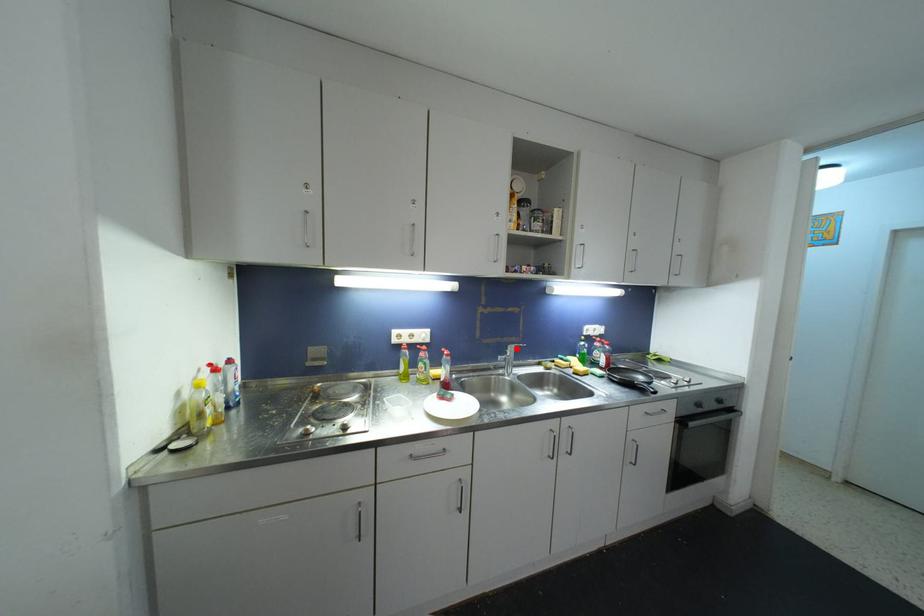
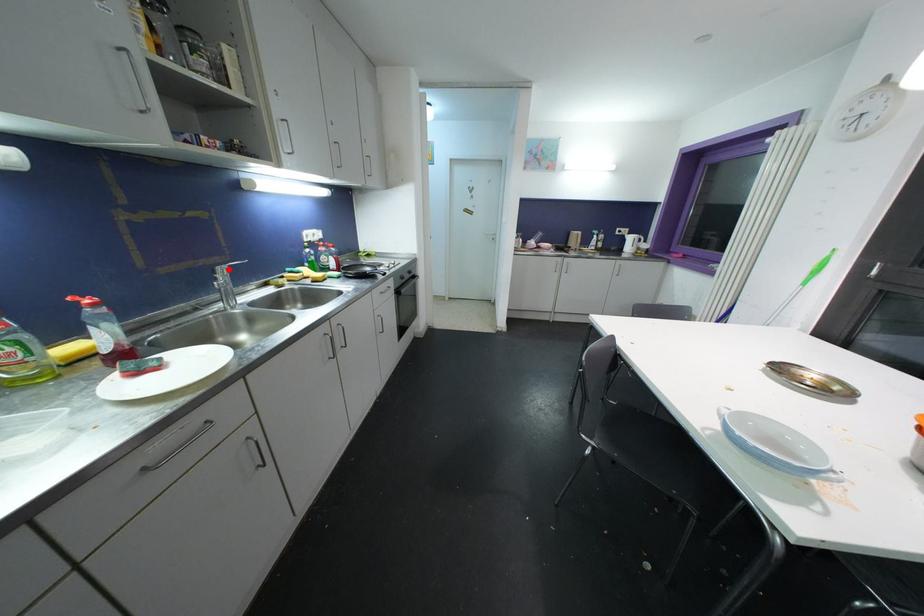
I am providing you with two images of the same scene from different viewpoints. A red point is marked on the first image and another point is marked on the second image. Is the marked point in image1 the same physical position as the marked point in image2?

Yes